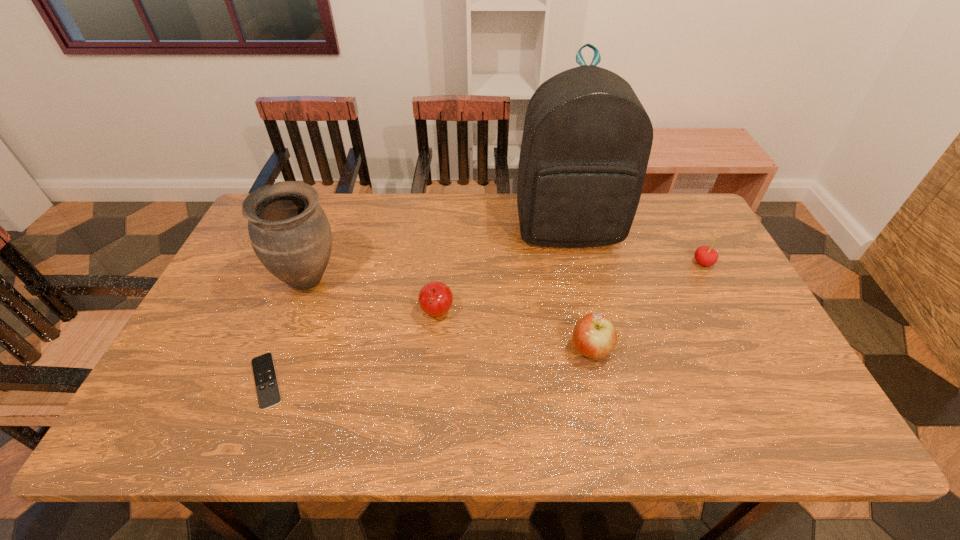
What are the coordinates of `free space located on the back of the rightmost object` in the screenshot? It's located at (677, 212).

You are a GUI agent. You are given a task and a screenshot of the screen. Output one action in this format:
    pyautogui.click(x=<x>, y=<y>)
    Task: Click on the free region located on the front of the third object from left to right
    This screenshot has width=960, height=540.
    Given the screenshot: What is the action you would take?
    pyautogui.click(x=433, y=356)

This screenshot has width=960, height=540. I want to click on vacant space located on the left of the apple, so click(545, 349).

What are the coordinates of `vacant space located 0.290m on the back of the remote control` in the screenshot? It's located at (309, 272).

Locate an element on the screen. The image size is (960, 540). object at the far edge is located at coordinates pyautogui.click(x=587, y=139).

Identify the location of object that is at the near edge. (268, 393).

This screenshot has height=540, width=960. I want to click on object that is at the left edge, so click(290, 234).

The height and width of the screenshot is (540, 960). Identify the location of object that is at the right edge. (704, 255).

At what (x,y) coordinates should I click in order to perform the action: click on vacant space at the far edge of the desktop. Please return your answer as a coordinate pair (x, y). Looking at the image, I should click on (458, 228).

Locate an element on the screen. This screenshot has width=960, height=540. vacant space at the near edge of the desktop is located at coordinates tap(284, 435).